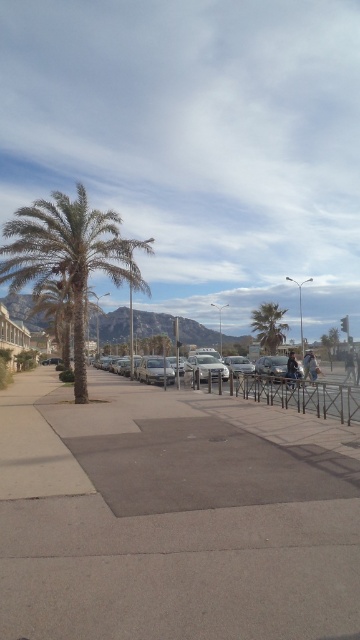
A hiker wants to place a 30 feet long tent between the green leafy palm tree at center and the denim jacket at lower right. Is there enough space?

The distance between the green leafy palm tree at center and the denim jacket at lower right is 32.60 feet. Since the tent is 30 feet long, there is enough space to place it between them.

You are a delivery person who needs to drive a 2.5 meter wide truck through the coastal road. The gray concrete pavement at center and the green leafy palm tree at center are in your path. Can your truck fit between them without hitting either?

The gray concrete pavement at center is wider than the green leafy palm tree at center. Since the pavement is wider, the 2.5 meter wide truck can likely fit between them as long as it stays on the pavement.